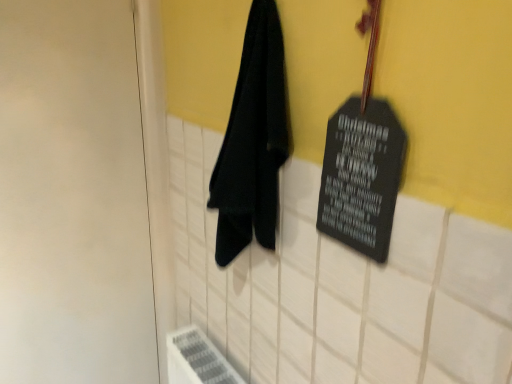
The image size is (512, 384). What do you see at coordinates (253, 141) in the screenshot? I see `black fabric towel at center` at bounding box center [253, 141].

Image resolution: width=512 pixels, height=384 pixels. I want to click on white matte door at left, so click(x=73, y=197).

Is black fabric towel at center smaller than black matte sign at upper right?

No.

What's the angular difference between black fabric towel at center and black matte sign at upper right's facing directions?

The facing directions of black fabric towel at center and black matte sign at upper right are 0.0038 degrees apart.

Is black fabric towel at center thinner than black matte sign at upper right?

Incorrect, the width of black fabric towel at center is not less than that of black matte sign at upper right.

Which object is positioned more to the left, white matte door at left or black matte sign at upper right?

From the viewer's perspective, white matte door at left appears more on the left side.

Can you see white matte door at left touching black matte sign at upper right?

white matte door at left is not next to black matte sign at upper right, and they're not touching.

The height and width of the screenshot is (384, 512). I want to click on bulletin board on the right of white matte door at left, so click(x=362, y=176).

From a real-world perspective, is white matte door at left on top of black matte sign at upper right?

Incorrect, from a real-world perspective, white matte door at left is lower than black matte sign at upper right.

From a real-world perspective, between black matte sign at upper right and black fabric towel at center, who is vertically higher?

In real-world perspective, black matte sign at upper right is above.

This screenshot has height=384, width=512. Identify the location of towel below the black matte sign at upper right (from the image's perspective). (253, 141).

Which of these two, black matte sign at upper right or black fabric towel at center, is wider?

Wider between the two is black fabric towel at center.

Looking at this image, between black matte sign at upper right and black fabric towel at center, which one is positioned behind?

Positioned behind is black fabric towel at center.

Looking at this image, is black matte sign at upper right positioned behind white matte door at left?

No.

Is black matte sign at upper right facing towards white matte door at left?

No, black matte sign at upper right is not aimed at white matte door at left.

Is black matte sign at upper right surrounding white matte door at left?

No.

From a real-world perspective, which is physically above, black matte sign at upper right or white matte door at left?

From a 3D spatial view, black matte sign at upper right is above.

Is black fabric towel at center facing away from white matte door at left?

black fabric towel at center does not have its back to white matte door at left.

Are black fabric towel at center and white matte door at left making contact?

No, black fabric towel at center is not beside white matte door at left.

Is point (271, 231) less distant than point (63, 97)?

Yes.

Would you say black fabric towel at center is inside or outside white matte door at left?

The correct answer is: outside.

Find the location of a particular element. towel located in front of the white matte door at left is located at coordinates (253, 141).

Which of these two, white matte door at left or black fabric towel at center, stands shorter?

black fabric towel at center is shorter.

Is white matte door at left outside of black fabric towel at center?

Yes, white matte door at left is outside of black fabric towel at center.

Are white matte door at left and black fabric towel at center beside each other?

No, white matte door at left is not touching black fabric towel at center.

Where is `bulletin board above the black fabric towel at center (from a real-world perspective)`? The image size is (512, 384). bulletin board above the black fabric towel at center (from a real-world perspective) is located at coordinates (362, 176).

Find the location of `door that appears below the black matte sign at upper right (from a real-world perspective)`. door that appears below the black matte sign at upper right (from a real-world perspective) is located at coordinates (73, 197).

Based on the photo, from the image, which object appears to be nearer to black fabric towel at center, black matte sign at upper right or white matte door at left?

black matte sign at upper right.

Which object lies further to the anchor point black matte sign at upper right, white matte door at left or black fabric towel at center?

white matte door at left is positioned further to the anchor black matte sign at upper right.

Which object lies nearer to the anchor point white matte door at left, black fabric towel at center or black matte sign at upper right?

black fabric towel at center is positioned closer to the anchor white matte door at left.

Based on their spatial positions, is white matte door at left or black matte sign at upper right closer to black fabric towel at center?

black matte sign at upper right lies closer to black fabric towel at center than the other object.

When comparing their distances from black matte sign at upper right, does black fabric towel at center or white matte door at left seem closer?

Among the two, black fabric towel at center is located nearer to black matte sign at upper right.

Looking at the image, which one is located closer to white matte door at left, black matte sign at upper right or black fabric towel at center?

black fabric towel at center is closer to white matte door at left.

The image size is (512, 384). Identify the location of towel located between white matte door at left and black matte sign at upper right in the left-right direction. (253, 141).